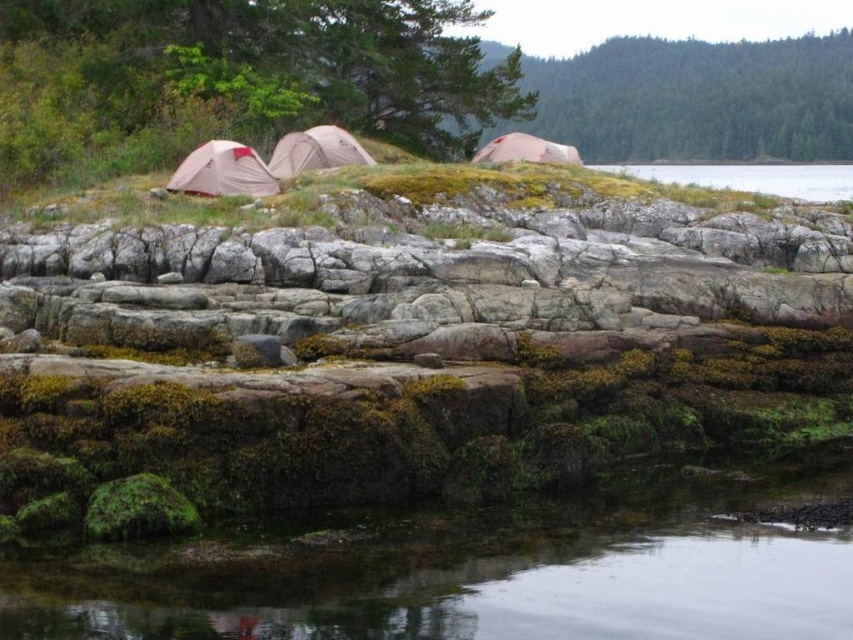
Can you confirm if clear water at lower right is bigger than matte gray tent at center?

Yes, clear water at lower right is bigger than matte gray tent at center.

Is clear water at lower right closer to camera compared to matte gray tent at center?

No.

Who is more distant from viewer, (817,200) or (370,161)?

Positioned behind is point (370,161).

Find the location of a particular element. This screenshot has width=853, height=640. clear water at lower right is located at coordinates (751, 177).

The width and height of the screenshot is (853, 640). Describe the element at coordinates (492, 577) in the screenshot. I see `clear water at lower center` at that location.

Identify the location of clear water at lower center. Image resolution: width=853 pixels, height=640 pixels. (492, 577).

Is clear water at lower right smaller than matte pink tent at center?

No, clear water at lower right is not smaller than matte pink tent at center.

Describe the element at coordinates (751, 177) in the screenshot. I see `clear water at lower right` at that location.

Is point (772, 180) positioned before point (563, 163)?

That is False.

Find the location of a particular element. This screenshot has width=853, height=640. clear water at lower right is located at coordinates (751, 177).